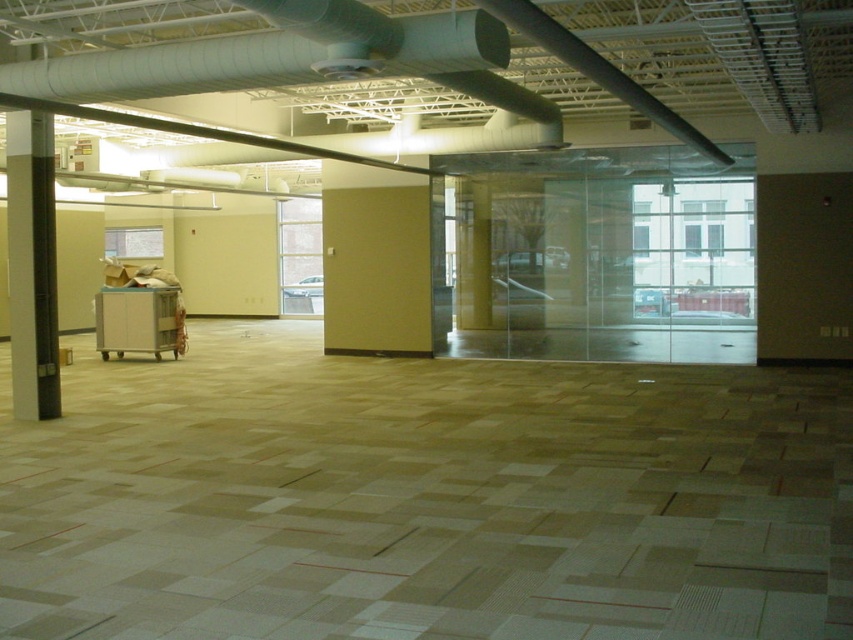
Question: Is beige matte wall at center to the left of white glossy pillar at left from the viewer's perspective?

Choices:
 (A) yes
 (B) no

Answer: (B)

Question: From the image, what is the correct spatial relationship of beige matte wall at center in relation to white glossy pillar at left?

Choices:
 (A) right
 (B) left

Answer: (A)

Question: Which point is farther from the camera taking this photo?

Choices:
 (A) (384, 180)
 (B) (33, 326)

Answer: (A)

Question: Does beige matte wall at center appear on the right side of white glossy pillar at left?

Choices:
 (A) no
 (B) yes

Answer: (B)

Question: Which object appears farthest from the camera in this image?

Choices:
 (A) white glossy pillar at left
 (B) beige matte wall at center

Answer: (B)